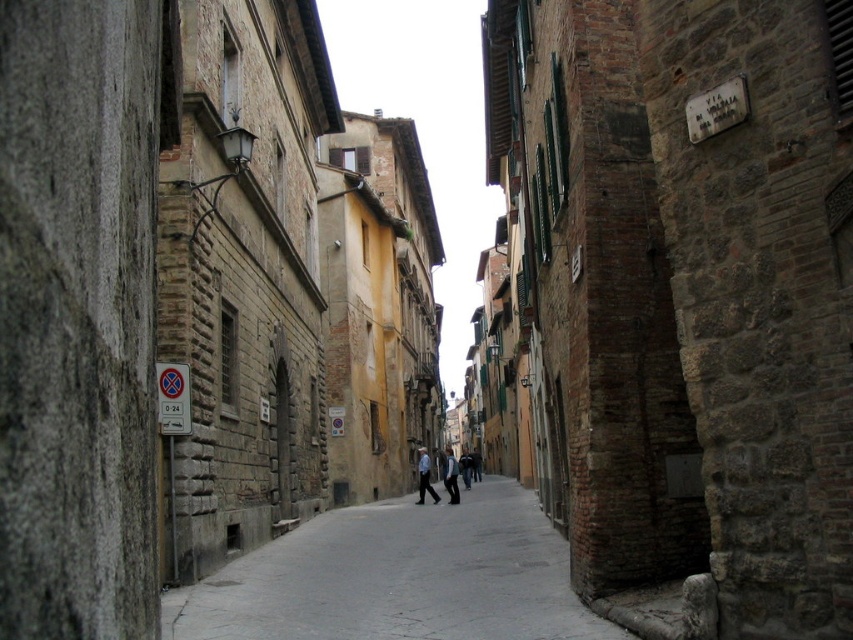
You are a delivery person carrying a heavy box and need to step onto the smooth concrete pavement at center. Are you currently standing in front of the blue denim jeans at center?

The smooth concrete pavement at center is in front of the blue denim jeans at center, so if you are stepping onto the smooth concrete pavement at center, you are indeed in front of the blue denim jeans at center.

From the picture: You are a photographer standing at the entrance of the street. You want to take a photo of the blue denim jeans at center. Is the distance within your camera lens range which can focus up to 30 meters?

The distance of blue denim jeans at center from camera is 27.47 meters, which is within the camera lens range of 30 meters. Therefore, the camera can focus on the blue denim jeans at center.

You are standing on the cobblestone street in the historic town and want to step onto the smooth concrete pavement at center. Where should you look to find it?

The smooth concrete pavement at center is located at point (397, 577).